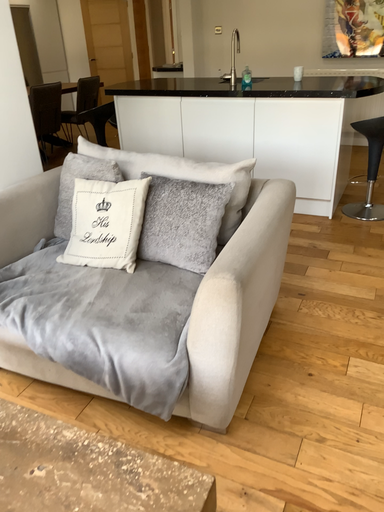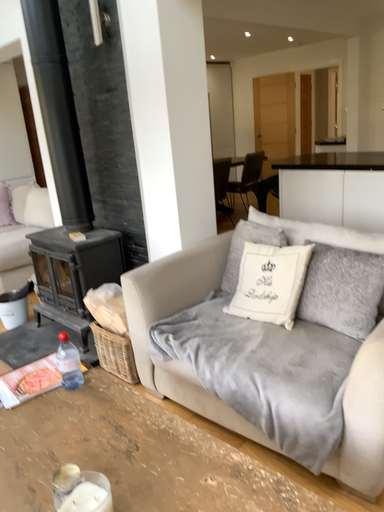
Question: How did the camera likely rotate when shooting the video?

Choices:
 (A) rotated downward
 (B) rotated upward

Answer: (B)